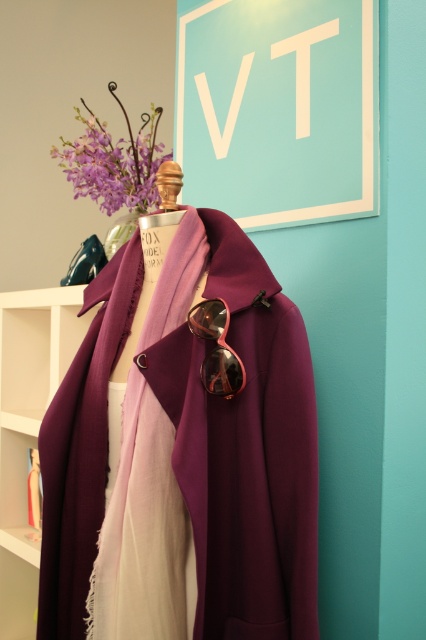
You are an interior designer assessing the layout of a boutique store. You need to ensure that all items are visible to customers. The matte purple coat at center and the white matte bookshelf at left are both in the customer viewing area. Which object is taller and might block the view of the other?

The white matte bookshelf at left is taller than the matte purple coat at center, so it might block the view of the coat.

You are a store manager checking the display. You see the matte purple coat at center and the white matte bookshelf at left. Which object is positioned higher in the image?

The matte purple coat at center is located above the white matte bookshelf at left, so it is positioned higher in the image.

You are a fashion designer examining the mannequin in the image. You need to adjust the placement of the matte purple coat at center and the purple matte scarf at center so that the scarf is positioned to the right of the coat. Is this possible without moving the coat or scarf from their current positions?

The matte purple coat at center is currently to the right of the purple matte scarf at center. To have the scarf to the right of the coat, you would need to move the scarf to the right side of the coat. Since the objects cannot be moved, this adjustment isn